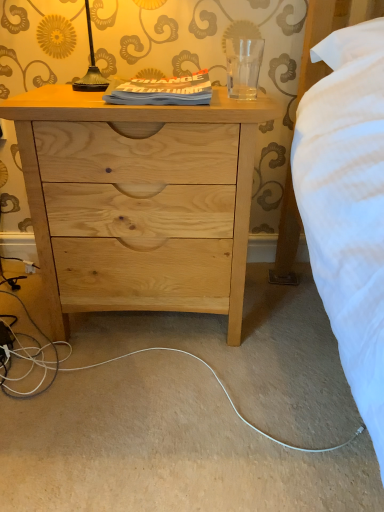
This screenshot has width=384, height=512. Describe the element at coordinates (138, 201) in the screenshot. I see `natural wood chest of drawers at center` at that location.

This screenshot has height=512, width=384. Identify the location of natural wood chest of drawers at center. (138, 201).

What is the approximate width of natural wood chest of drawers at center?

The width of natural wood chest of drawers at center is 42.96 centimeters.

Where is `natural wood chest of drawers at center`? The image size is (384, 512). natural wood chest of drawers at center is located at coordinates (138, 201).